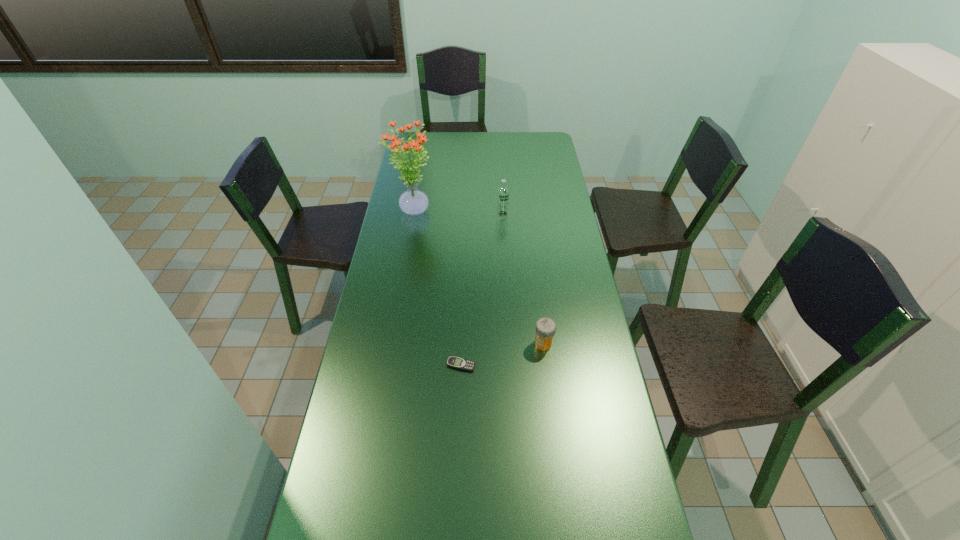
You are a GUI agent. You are given a task and a screenshot of the screen. Output one action in this format:
    pyautogui.click(x=<x>, y=<y>)
    Task: Click on the free location located 0.310m on the label side of the medicine
    
    Given the screenshot: What is the action you would take?
    click(x=435, y=343)

I want to click on vacant space situated on the label side of the medicine, so click(469, 343).

Locate an element on the screen. free spot located on the label side of the medicine is located at coordinates (409, 343).

Locate an element on the screen. This screenshot has height=540, width=960. vacant region located 0.320m on the front of the shortest object is located at coordinates (457, 484).

The height and width of the screenshot is (540, 960). I want to click on object present at the left edge, so click(x=413, y=202).

I want to click on object that is at the right edge, so click(545, 328).

Locate an element on the screen. The width and height of the screenshot is (960, 540). vacant area at the far edge is located at coordinates (464, 143).

Locate an element on the screen. This screenshot has height=540, width=960. free space at the left edge of the desktop is located at coordinates (388, 462).

Where is `free space at the right edge of the desktop`? free space at the right edge of the desktop is located at coordinates (561, 309).

Where is `free area in between the shortest object and the medicine`? free area in between the shortest object and the medicine is located at coordinates (502, 354).